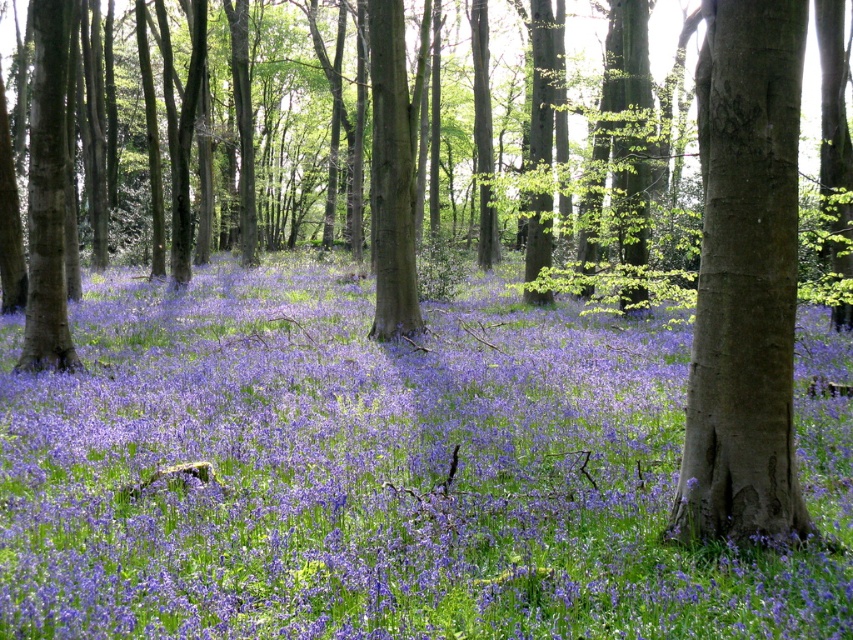
Does purple matte flower at center appear over brown rough bark tree at right?

No, purple matte flower at center is not above brown rough bark tree at right.

Who is more distant from viewer, (253, 419) or (782, 531)?

Point (253, 419)

Which is in front, point (492, 428) or point (724, 170)?

Point (724, 170)

Locate an element on the screen. Image resolution: width=853 pixels, height=640 pixels. purple matte flower at center is located at coordinates (386, 472).